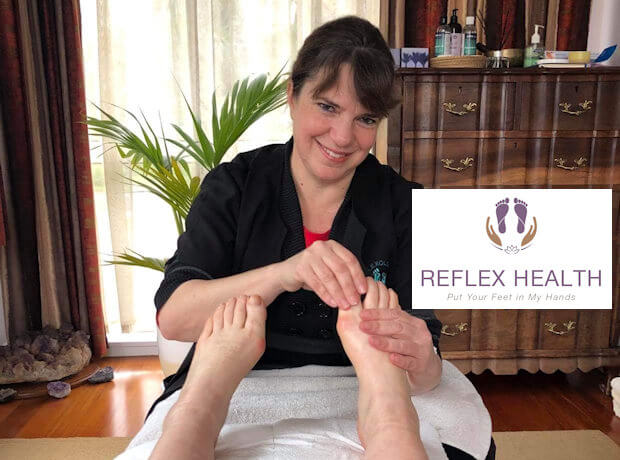
Where is `handle`? This screenshot has height=460, width=620. handle is located at coordinates (465, 110).